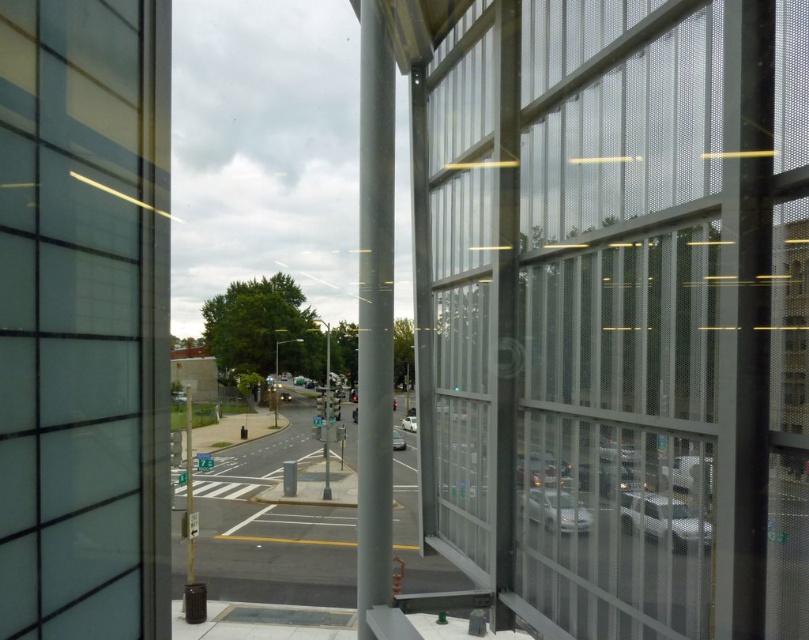
Does clear mesh screen at right appear over metallic silver sedan at center?

Yes, clear mesh screen at right is above metallic silver sedan at center.

Between point (536, 13) and point (532, 476), which one is positioned behind?

The point (532, 476) is more distant.

You are a GUI agent. You are given a task and a screenshot of the screen. Output one action in this format:
    pyautogui.click(x=<x>, y=<y>)
    Task: Click on the clear mesh screen at right
    The width and height of the screenshot is (809, 640).
    Given the screenshot: What is the action you would take?
    pyautogui.click(x=623, y=305)

Does metallic silver sedan at center have a larger size compared to silver metallic car at center?

Actually, metallic silver sedan at center might be smaller than silver metallic car at center.

Locate an element on the screen. The image size is (809, 640). metallic silver sedan at center is located at coordinates [x=541, y=470].

From the picture: Which of these two, clear mesh screen at right or shiny silver sedan at center, stands shorter?

shiny silver sedan at center is shorter.

The height and width of the screenshot is (640, 809). What do you see at coordinates (623, 305) in the screenshot?
I see `clear mesh screen at right` at bounding box center [623, 305].

Is point (596, 512) positioned in front of point (286, 392)?

Yes, point (596, 512) is in front of point (286, 392).

Identify the location of clear mesh screen at right. The height and width of the screenshot is (640, 809). pos(623,305).